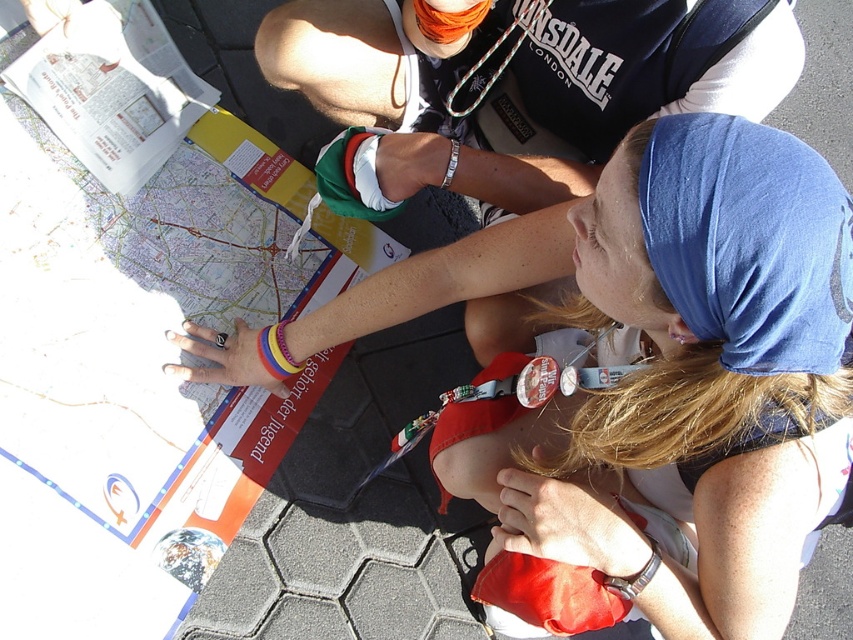
Who is shorter, white matte map at center or dark blue fabric shirt at upper center?

Standing shorter between the two is dark blue fabric shirt at upper center.

Is white matte map at center thinner than dark blue fabric shirt at upper center?

No.

Where is `white matte map at center`? The width and height of the screenshot is (853, 640). white matte map at center is located at coordinates (682, 381).